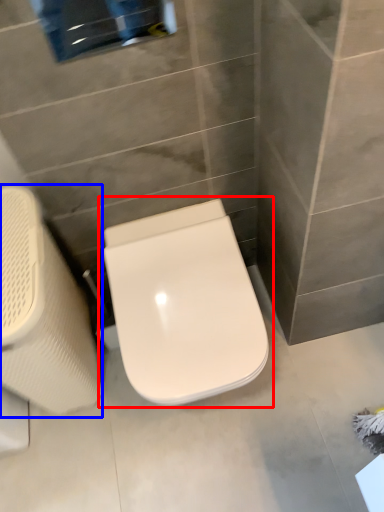
Question: Which object appears closest to the camera in this image, toilet (highlighted by a red box) or swivel chair (highlighted by a blue box)?

Choices:
 (A) toilet
 (B) swivel chair

Answer: (B)